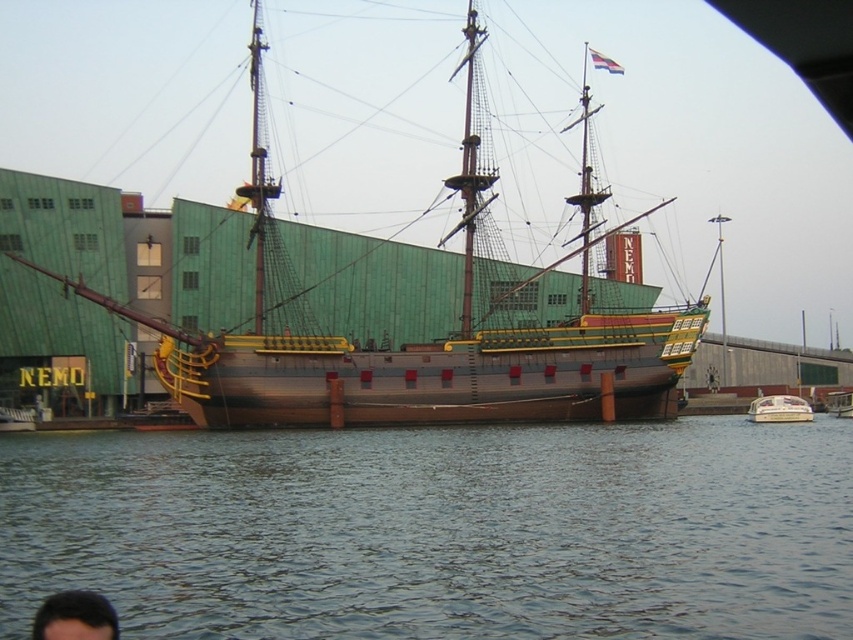
Does wooden pirate ship at center appear on the right side of dark brown hair at lower left?

Indeed, wooden pirate ship at center is positioned on the right side of dark brown hair at lower left.

Who is higher up, wooden pirate ship at center or dark brown hair at lower left?

wooden pirate ship at center is higher up.

Locate an element on the screen. The width and height of the screenshot is (853, 640). wooden pirate ship at center is located at coordinates (410, 342).

Does point (271, 182) lie behind point (767, 412)?

No, (271, 182) is closer to viewer.

Can you confirm if wooden pirate ship at center is wider than white plastic boat at lower right?

Correct, the width of wooden pirate ship at center exceeds that of white plastic boat at lower right.

Locate an element on the screen. The width and height of the screenshot is (853, 640). wooden pirate ship at center is located at coordinates (410, 342).

Image resolution: width=853 pixels, height=640 pixels. I want to click on wooden pirate ship at center, so click(410, 342).

Who is taller, dark blue water at lower center or dark brown hair at lower left?

With more height is dark blue water at lower center.

The image size is (853, 640). What do you see at coordinates (439, 531) in the screenshot?
I see `dark blue water at lower center` at bounding box center [439, 531].

Between point (708, 586) and point (44, 632), which one is positioned in front?

Point (44, 632) is more forward.

Locate an element on the screen. dark blue water at lower center is located at coordinates (439, 531).